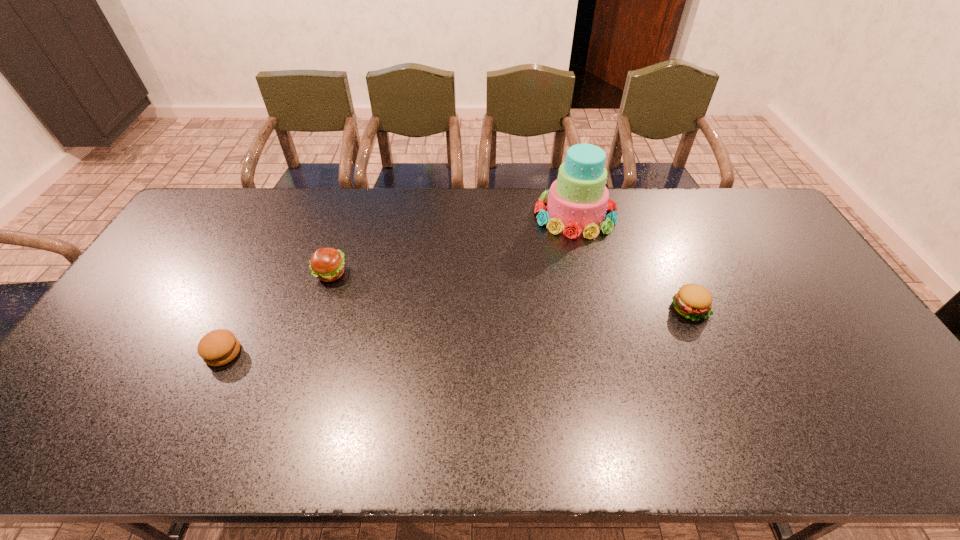
This screenshot has height=540, width=960. What are the coordinates of `vacant region located 0.310m on the right of the rightmost object` in the screenshot? It's located at (816, 309).

Image resolution: width=960 pixels, height=540 pixels. I want to click on vacant space situated on the front of the leftmost object, so click(x=189, y=423).

The width and height of the screenshot is (960, 540). What are the coordinates of `object positioned at the far edge` in the screenshot? It's located at point(578,199).

The image size is (960, 540). In order to click on vacant space at the far edge of the desktop in this screenshot , I will do `click(332, 208)`.

Identify the location of vacant area at the near edge. (699, 434).

Where is `vacant space at the right edge of the desktop`? The image size is (960, 540). vacant space at the right edge of the desktop is located at coordinates (778, 298).

The image size is (960, 540). In the image, there is a desktop. What are the coordinates of `vacant space at the far right corner` in the screenshot? It's located at (714, 198).

You are a GUI agent. You are given a task and a screenshot of the screen. Output one action in this format:
    pyautogui.click(x=<x>, y=<y>)
    Task: Click on the free area in between the nearest object and the rightmost object
    
    Given the screenshot: What is the action you would take?
    pyautogui.click(x=456, y=331)

Identify the location of vacant space that's between the second shortest hamburger and the second hamburger from right to left. (510, 292).

Where is `blank region between the third nearest object and the leftmost hamburger`? blank region between the third nearest object and the leftmost hamburger is located at coordinates (276, 313).